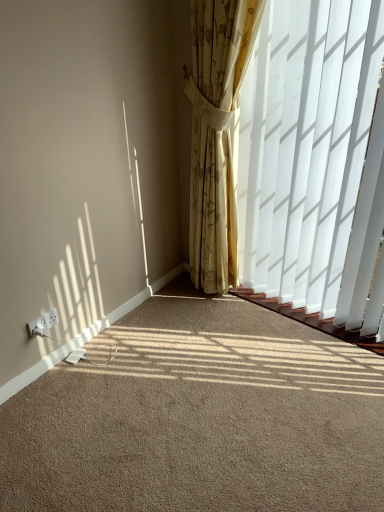
Question: Considering the positions of point (52, 316) and point (339, 343), is point (52, 316) closer or farther from the camera than point (339, 343)?

Choices:
 (A) closer
 (B) farther

Answer: (A)

Question: Considering the relative positions of white plastic electric outlet at lower left and beige carpet at lower left in the image provided, is white plastic electric outlet at lower left to the left or to the right of beige carpet at lower left?

Choices:
 (A) left
 (B) right

Answer: (A)

Question: Which object is the farthest from the yellow floral fabric curtain at center?

Choices:
 (A) white plastic electric outlet at lower left
 (B) beige carpet at lower left

Answer: (A)

Question: Which object is the farthest from the beige carpet at lower left?

Choices:
 (A) white plastic electric outlet at lower left
 (B) yellow floral fabric curtain at center

Answer: (B)